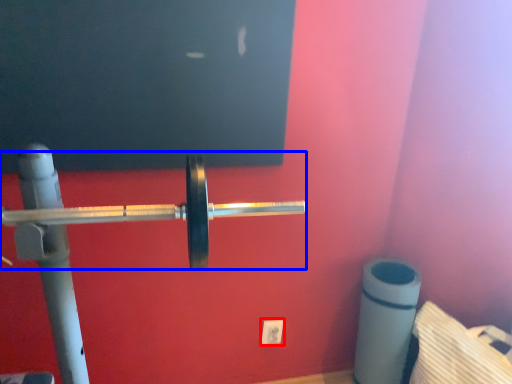
Question: Among these objects, which one is farthest to the camera, power plugs and sockets (highlighted by a red box) or barbell (highlighted by a blue box)?

Choices:
 (A) power plugs and sockets
 (B) barbell

Answer: (A)